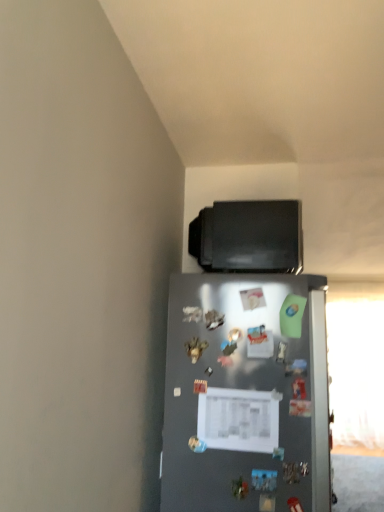
Question: From the image's perspective, is satin silver refrigerator at center over black matte tv at upper center?

Choices:
 (A) no
 (B) yes

Answer: (A)

Question: Is satin silver refrigerator at center aimed at black matte tv at upper center?

Choices:
 (A) yes
 (B) no

Answer: (B)

Question: From a real-world perspective, is satin silver refrigerator at center positioned under black matte tv at upper center based on gravity?

Choices:
 (A) no
 (B) yes

Answer: (B)

Question: Does satin silver refrigerator at center have a larger size compared to black matte tv at upper center?

Choices:
 (A) yes
 (B) no

Answer: (A)

Question: Is satin silver refrigerator at center shorter than black matte tv at upper center?

Choices:
 (A) yes
 (B) no

Answer: (B)

Question: Are satin silver refrigerator at center and black matte tv at upper center located far from each other?

Choices:
 (A) yes
 (B) no

Answer: (B)

Question: Is satin silver refrigerator at center at the back of black matte tv at upper center?

Choices:
 (A) yes
 (B) no

Answer: (B)

Question: Can you confirm if black matte tv at upper center is bigger than satin silver refrigerator at center?

Choices:
 (A) no
 (B) yes

Answer: (A)

Question: Is black matte tv at upper center to the right of satin silver refrigerator at center from the viewer's perspective?

Choices:
 (A) no
 (B) yes

Answer: (B)

Question: From the image's perspective, is black matte tv at upper center on satin silver refrigerator at center?

Choices:
 (A) yes
 (B) no

Answer: (A)

Question: Is black matte tv at upper center touching satin silver refrigerator at center?

Choices:
 (A) no
 (B) yes

Answer: (A)

Question: Can you confirm if black matte tv at upper center is shorter than satin silver refrigerator at center?

Choices:
 (A) yes
 (B) no

Answer: (A)

Question: From a real-world perspective, relative to satin silver refrigerator at center, is black matte tv at upper center vertically above or below?

Choices:
 (A) above
 (B) below

Answer: (A)